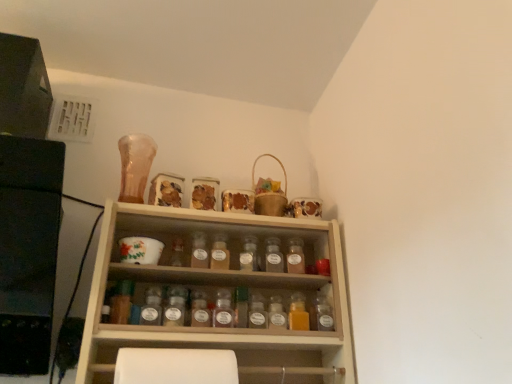
Question: Which direction should I rotate to look at translucent glass spice at center, marked as the seventh bottle in a right-to-left arrangement, — up or down?

Choices:
 (A) up
 (B) down

Answer: (B)

Question: From the image's perspective, is translucent plastic spice jar at center, which is the eighth bottle from left to right, over translucent glass bottle at center, the 1th bottle when ordered from left to right?

Choices:
 (A) yes
 (B) no

Answer: (B)

Question: Is translucent plastic spice jar at center, which is the eighth bottle from left to right, not near translucent glass bottle at center, the 11th bottle when ordered from right to left?

Choices:
 (A) no
 (B) yes

Answer: (A)

Question: Does translucent plastic spice jar at center, which is the eighth bottle from left to right, have a lesser height compared to translucent glass bottle at center, the 11th bottle when ordered from right to left?

Choices:
 (A) no
 (B) yes

Answer: (B)

Question: Considering the relative sizes of translucent plastic spice jar at center, which is the eighth bottle from left to right, and translucent glass bottle at center, the 1th bottle when ordered from left to right, in the image provided, is translucent plastic spice jar at center, which is the eighth bottle from left to right, smaller than translucent glass bottle at center, the 1th bottle when ordered from left to right,?

Choices:
 (A) no
 (B) yes

Answer: (A)

Question: Is translucent plastic spice jar at center, which ranks as the 4th bottle in right-to-left order, bigger than translucent glass bottle at center, the 1th bottle when ordered from left to right?

Choices:
 (A) yes
 (B) no

Answer: (A)

Question: Is translucent plastic spice jar at center, which is the eighth bottle from left to right, outside translucent glass bottle at center, the 1th bottle when ordered from left to right?

Choices:
 (A) yes
 (B) no

Answer: (A)

Question: Is translucent amber bottle at center, the first bottle from the right, positioned beyond the bounds of translucent glass spice at center, marked as the seventh bottle in a right-to-left arrangement?

Choices:
 (A) no
 (B) yes

Answer: (B)

Question: From a real-world perspective, is translucent amber bottle at center, the first bottle from the right, under translucent glass spice at center, marked as the seventh bottle in a right-to-left arrangement?

Choices:
 (A) yes
 (B) no

Answer: (A)

Question: From the image's perspective, would you say translucent amber bottle at center, which ranks as the 11th bottle in left-to-right order, is shown under translucent glass spice at center, marked as the seventh bottle in a right-to-left arrangement?

Choices:
 (A) no
 (B) yes

Answer: (B)

Question: Can you confirm if translucent amber bottle at center, which ranks as the 11th bottle in left-to-right order, is taller than translucent glass spice at center, arranged as the fifth bottle when viewed from the left?

Choices:
 (A) yes
 (B) no

Answer: (B)

Question: Is translucent amber bottle at center, the first bottle from the right, bigger than translucent glass spice at center, arranged as the fifth bottle when viewed from the left?

Choices:
 (A) yes
 (B) no

Answer: (B)

Question: Is translucent amber bottle at center, the first bottle from the right, positioned before translucent glass spice at center, arranged as the fifth bottle when viewed from the left?

Choices:
 (A) no
 (B) yes

Answer: (A)

Question: Considering the relative sizes of translucent glass bottle at center, the 11th bottle when ordered from right to left, and translucent glass spice jar at center, which ranks as the 10th bottle in right-to-left order, in the image provided, is translucent glass bottle at center, the 11th bottle when ordered from right to left, taller than translucent glass spice jar at center, which ranks as the 10th bottle in right-to-left order,?

Choices:
 (A) no
 (B) yes

Answer: (B)